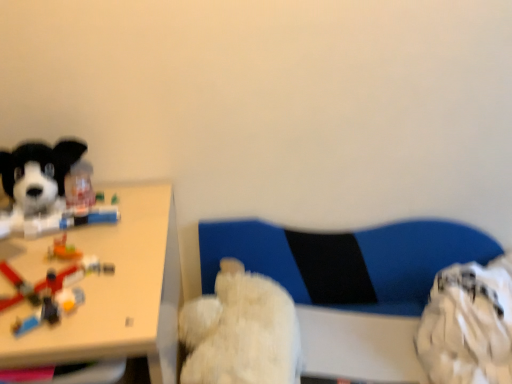
In order to click on spots to the right of soft plush dog at left, which is counted as the 2th dog, starting from the bottom in this screenshot , I will do `click(131, 215)`.